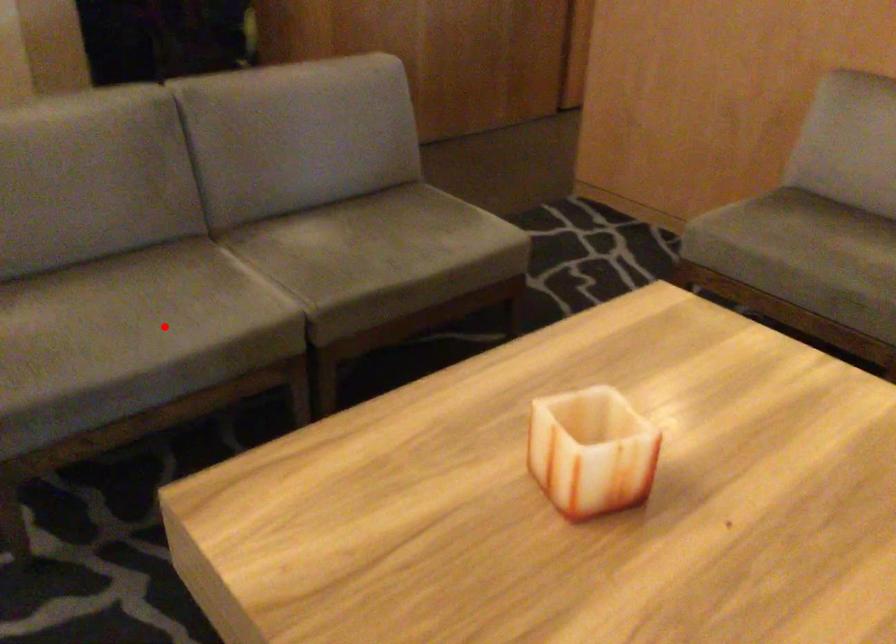
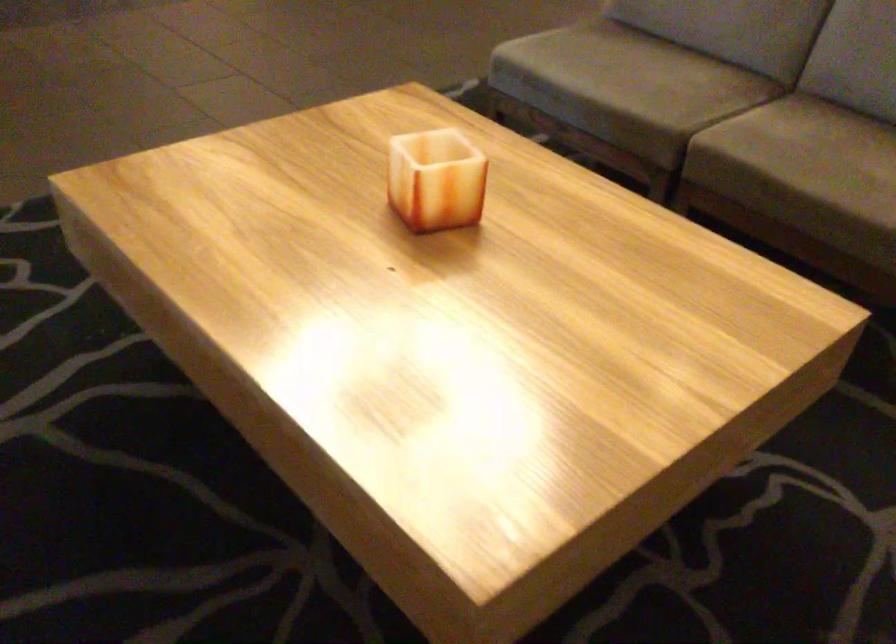
Where in the second image is the point corresponding to the highlighted location from the first image?

(622, 80)